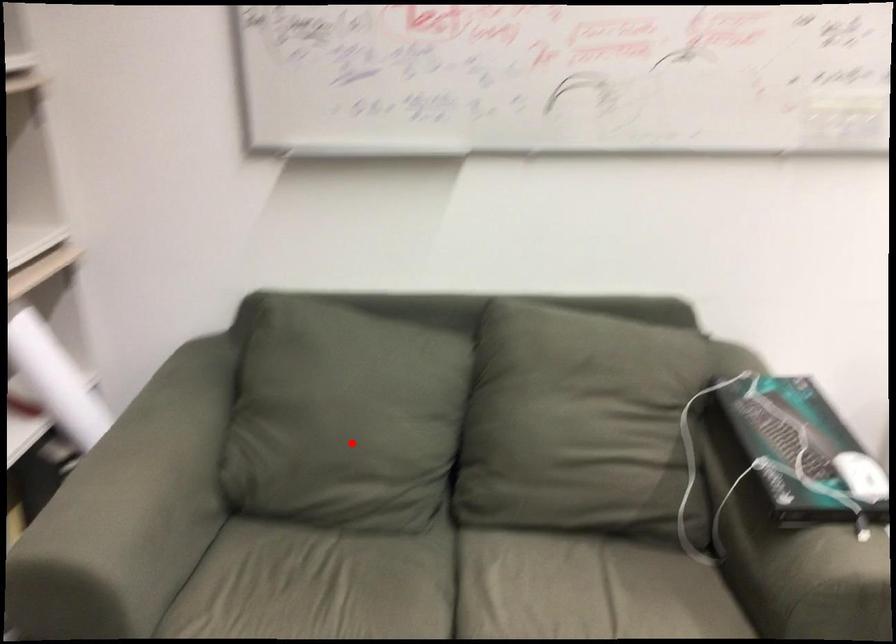
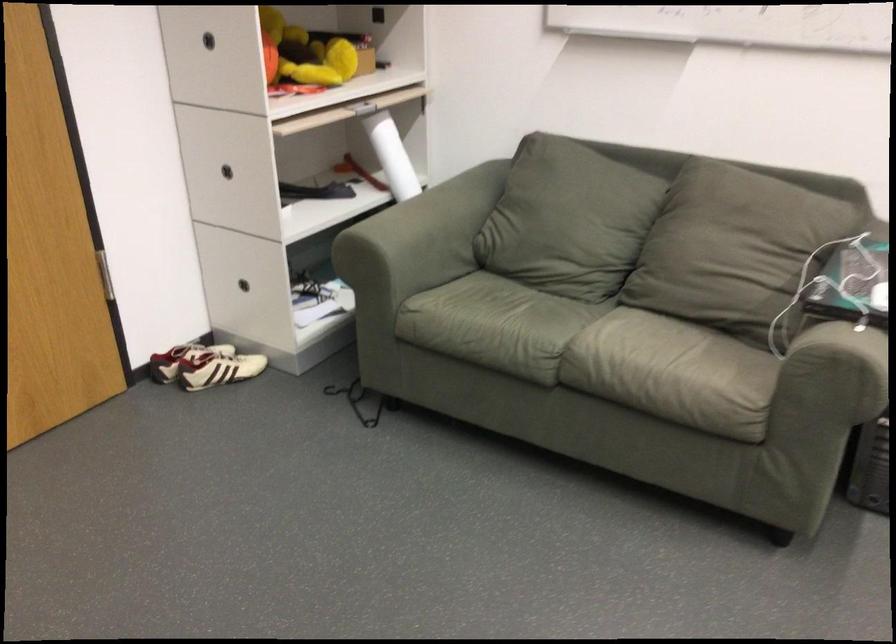
Find the pixel in the second image that matches the highlighted location in the first image.

(558, 232)